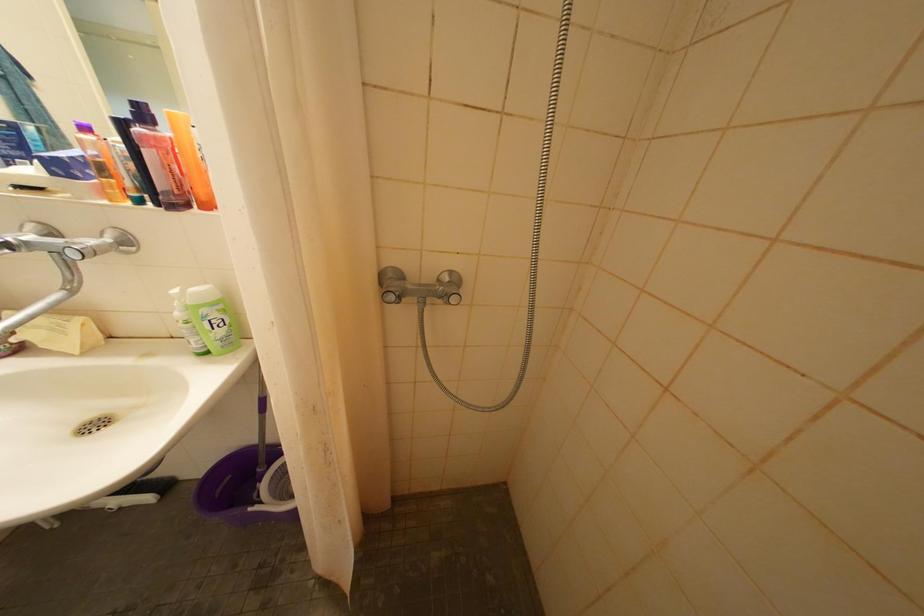
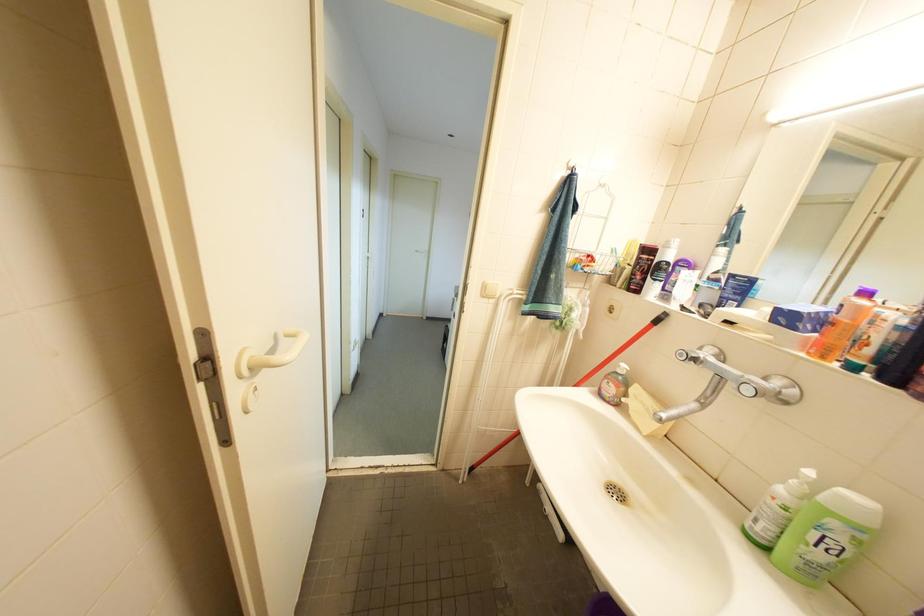
Question: The camera is either moving clockwise (left) or counter-clockwise (right) around the object. The first image is from the beginning of the video and the second image is from the end. Is the camera moving left or right when shooting the video?

Choices:
 (A) Left
 (B) Right

Answer: (B)